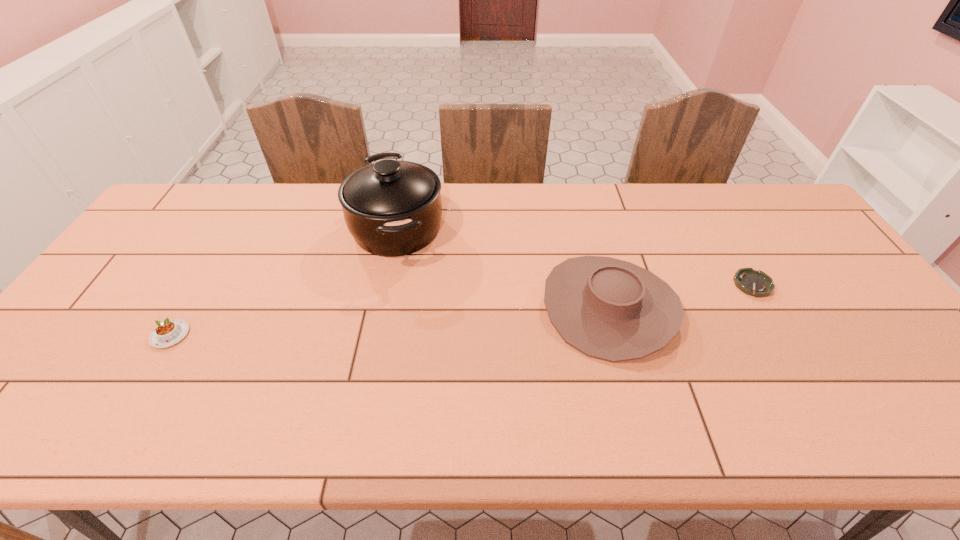
This screenshot has width=960, height=540. In order to click on vacant space that satisfies the following two spatial constraints: 1. on the back side of the second shortest object; 2. on the left side of the shortest object in this screenshot , I will do `click(201, 285)`.